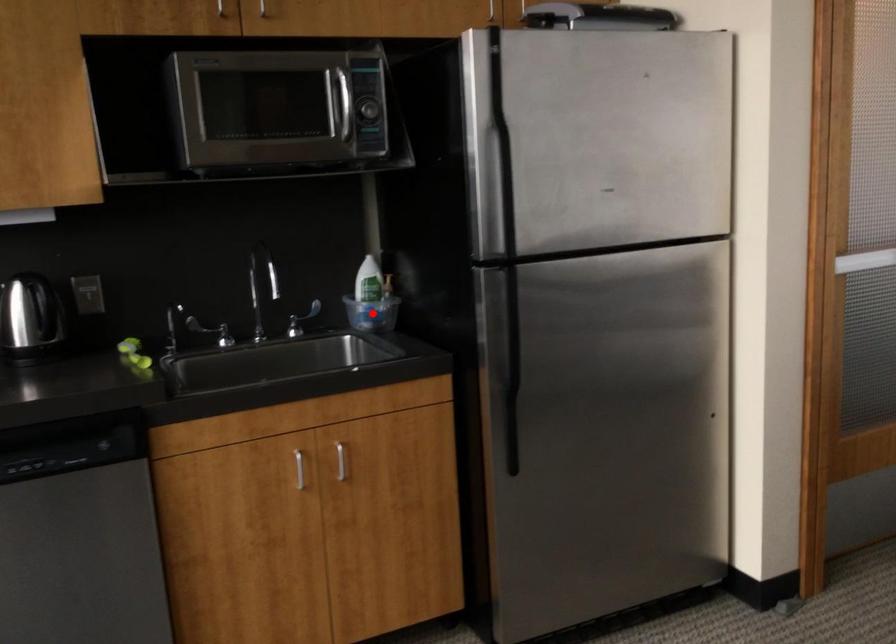
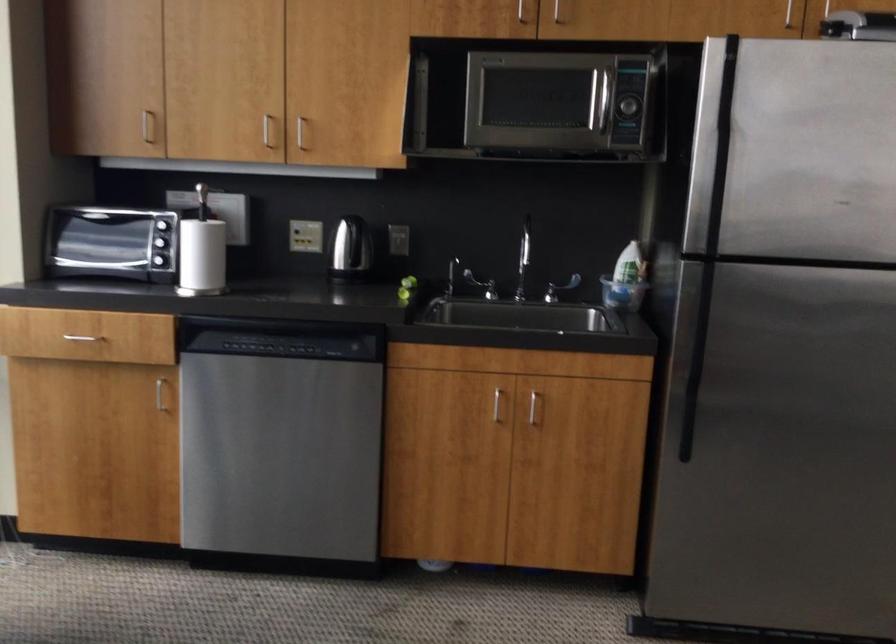
Find the pixel in the second image that matches the highlighted location in the first image.

(622, 294)